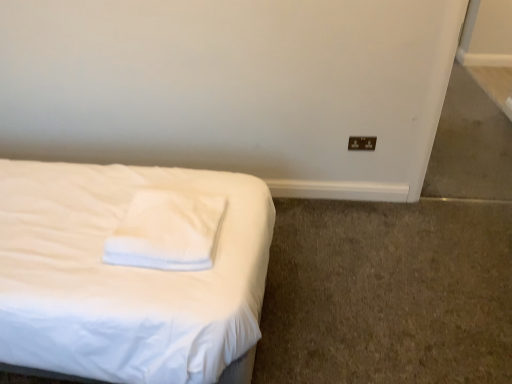
Question: Considering the relative sizes of black plastic electric outlet at upper right and white soft pillow at center in the image provided, is black plastic electric outlet at upper right shorter than white soft pillow at center?

Choices:
 (A) yes
 (B) no

Answer: (B)

Question: From the image's perspective, is black plastic electric outlet at upper right over white soft pillow at center?

Choices:
 (A) yes
 (B) no

Answer: (A)

Question: From a real-world perspective, is black plastic electric outlet at upper right located higher than white soft pillow at center?

Choices:
 (A) no
 (B) yes

Answer: (A)

Question: Is black plastic electric outlet at upper right to the right of white soft pillow at center from the viewer's perspective?

Choices:
 (A) no
 (B) yes

Answer: (B)

Question: From a real-world perspective, is black plastic electric outlet at upper right under white soft pillow at center?

Choices:
 (A) yes
 (B) no

Answer: (A)

Question: Considering the relative sizes of black plastic electric outlet at upper right and white soft pillow at center in the image provided, is black plastic electric outlet at upper right wider than white soft pillow at center?

Choices:
 (A) no
 (B) yes

Answer: (A)

Question: Is black plastic electric outlet at upper right inside white soft pillow at center?

Choices:
 (A) no
 (B) yes

Answer: (A)

Question: From a real-world perspective, is white soft pillow at center under black plastic electric outlet at upper right?

Choices:
 (A) yes
 (B) no

Answer: (B)

Question: From the image's perspective, is white soft pillow at center on black plastic electric outlet at upper right?

Choices:
 (A) no
 (B) yes

Answer: (A)

Question: From the image's perspective, is white soft pillow at center below black plastic electric outlet at upper right?

Choices:
 (A) yes
 (B) no

Answer: (A)

Question: Would you say white soft pillow at center is a long distance from black plastic electric outlet at upper right?

Choices:
 (A) yes
 (B) no

Answer: (A)

Question: Is white soft pillow at center positioned beyond the bounds of black plastic electric outlet at upper right?

Choices:
 (A) no
 (B) yes

Answer: (B)

Question: Which is correct: white soft pillow at center is inside black plastic electric outlet at upper right, or outside of it?

Choices:
 (A) inside
 (B) outside

Answer: (B)